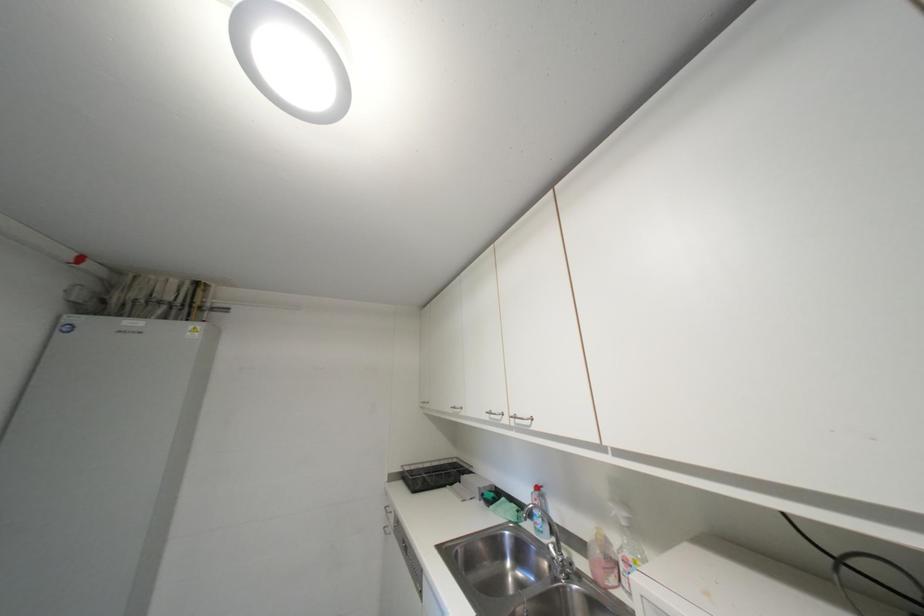
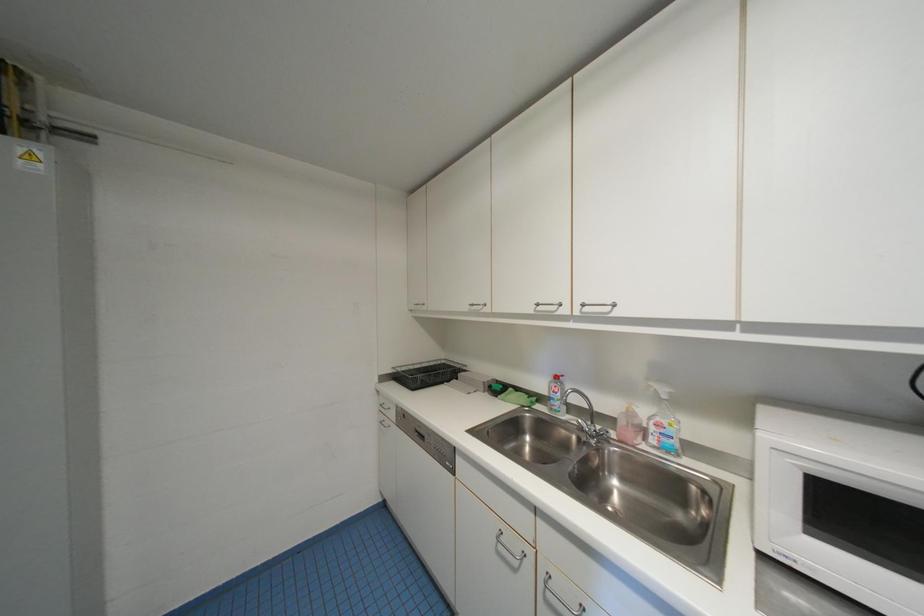
The images are taken continuously from a first-person perspective. In which direction are you moving?

The cameraman moved toward left, forward.